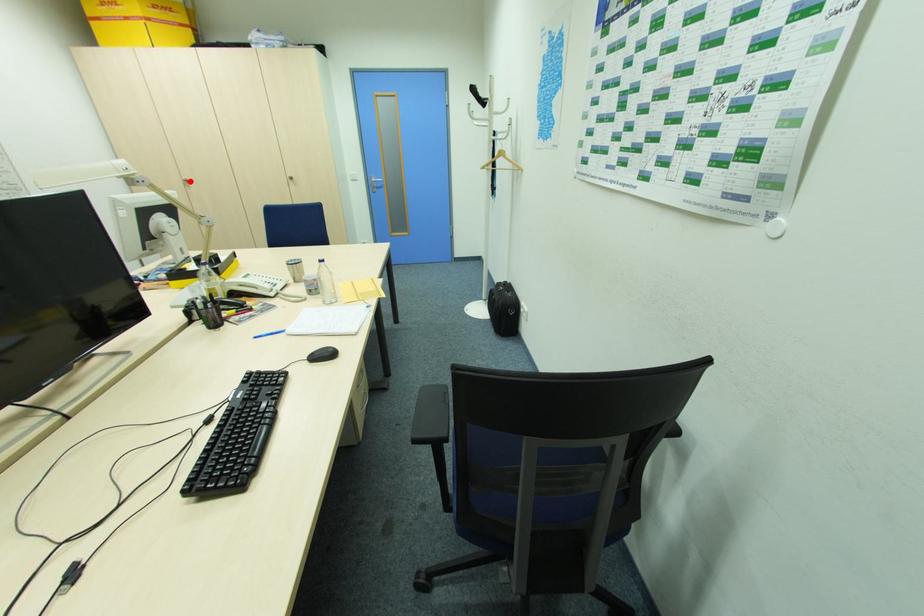
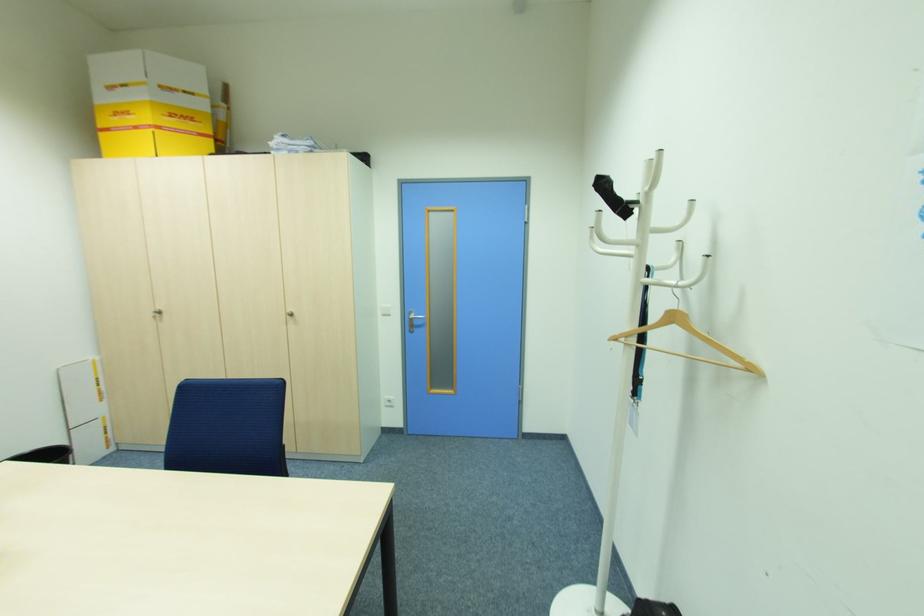
Question: I am providing you with two images of the same scene from different viewpoints. A red point is marked on the first image. Can you still see the location of the red point in image 2?

Choices:
 (A) Yes
 (B) No

Answer: (A)